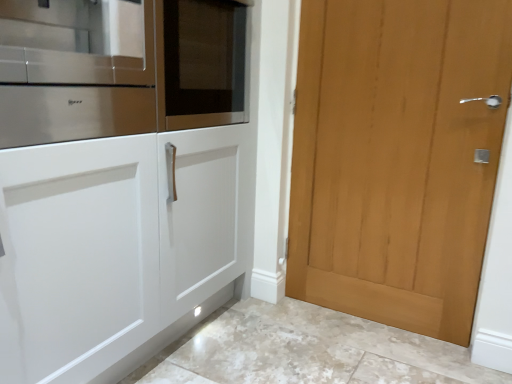
Describe the element at coordinates (396, 158) in the screenshot. I see `light brown wood door at right` at that location.

The image size is (512, 384). What are the coordinates of `light brown wood door at right` in the screenshot? It's located at (396, 158).

You are a GUI agent. You are given a task and a screenshot of the screen. Output one action in this format:
    pyautogui.click(x=<x>, y=<y>)
    Task: Click on the white marble floor at lower center
    This screenshot has width=512, height=384.
    Given the screenshot: What is the action you would take?
    pyautogui.click(x=313, y=351)

This screenshot has width=512, height=384. Identify the location of stainless steel oven at left. (75, 70).

Is point (147, 10) positioned before point (285, 357)?

Yes, it is in front of point (285, 357).

From the picture: Considering the relative sizes of stainless steel oven at left and white marble floor at lower center in the image provided, is stainless steel oven at left bigger than white marble floor at lower center?

Incorrect, stainless steel oven at left is not larger than white marble floor at lower center.

From the image's perspective, would you say stainless steel oven at left is shown under white marble floor at lower center?

No, from the image's perspective, stainless steel oven at left is not beneath white marble floor at lower center.

Is stainless steel oven at left positioned with its back to white marble floor at lower center?

No, stainless steel oven at left is not facing the opposite direction of white marble floor at lower center.

Would you say white marble floor at lower center is to the left or to the right of light brown wood door at right in the picture?

white marble floor at lower center is to the left of light brown wood door at right.

From a real-world perspective, between white marble floor at lower center and light brown wood door at right, who is vertically lower?

white marble floor at lower center is physically lower.

Locate an element on the screen. granite lying below the light brown wood door at right (from the image's perspective) is located at coordinates (313, 351).

Which object is closer to the camera taking this photo, white marble floor at lower center or light brown wood door at right?

white marble floor at lower center is closer to the camera.

Based on their positions, is stainless steel oven at left located to the left or right of light brown wood door at right?

In the image, stainless steel oven at left appears on the left side of light brown wood door at right.

Is light brown wood door at right located within stainless steel oven at left?

No, light brown wood door at right is not inside stainless steel oven at left.

Is stainless steel oven at left in contact with light brown wood door at right?

No, stainless steel oven at left is not making contact with light brown wood door at right.

Which of these two, stainless steel oven at left or light brown wood door at right, stands shorter?

stainless steel oven at left is shorter.

Looking at their sizes, would you say light brown wood door at right is wider or thinner than stainless steel oven at left?

In the image, light brown wood door at right appears to be more narrow than stainless steel oven at left.

Are light brown wood door at right and stainless steel oven at left beside each other?

No, light brown wood door at right is not touching stainless steel oven at left.

From the image's perspective, which is above, light brown wood door at right or stainless steel oven at left?

stainless steel oven at left.

Is white marble floor at lower center at the back of light brown wood door at right?

That's not correct — light brown wood door at right is not looking away from white marble floor at lower center.

From the image's perspective, is light brown wood door at right located beneath white marble floor at lower center?

No.

Considering the relative positions of light brown wood door at right and white marble floor at lower center in the image provided, is light brown wood door at right to the left or to the right of white marble floor at lower center?

light brown wood door at right is to the right of white marble floor at lower center.

From a real-world perspective, between white marble floor at lower center and stainless steel oven at left, who is vertically higher?

stainless steel oven at left is physically above.

Who is smaller, white marble floor at lower center or stainless steel oven at left?

stainless steel oven at left is smaller.

Looking at this image, between white marble floor at lower center and stainless steel oven at left, which one appears on the left side from the viewer's perspective?

From the viewer's perspective, stainless steel oven at left appears more on the left side.

From the image's perspective, who appears lower, white marble floor at lower center or stainless steel oven at left?

white marble floor at lower center is shown below in the image.

Find the location of a particular element. cabinetry above the white marble floor at lower center (from the image's perspective) is located at coordinates (75, 70).

Locate an element on the screen. The height and width of the screenshot is (384, 512). door that is behind the white marble floor at lower center is located at coordinates (396, 158).

Considering their positions, is white marble floor at lower center positioned closer to stainless steel oven at left than light brown wood door at right?

Based on the image, light brown wood door at right appears to be nearer to stainless steel oven at left.

Looking at the image, which one is located further to stainless steel oven at left, light brown wood door at right or white marble floor at lower center?

A: white marble floor at lower center is positioned further to the anchor stainless steel oven at left.

Looking at the image, which one is located closer to light brown wood door at right, stainless steel oven at left or white marble floor at lower center?

The object closer to light brown wood door at right is white marble floor at lower center.

In the scene shown: Looking at the image, which one is located further to white marble floor at lower center, stainless steel oven at left or light brown wood door at right?

stainless steel oven at left is further to white marble floor at lower center.

From the image, which object appears to be nearer to white marble floor at lower center, light brown wood door at right or stainless steel oven at left?

The object closer to white marble floor at lower center is light brown wood door at right.

Looking at this image, from the image, which object appears to be farther from light brown wood door at right, white marble floor at lower center or stainless steel oven at left?

stainless steel oven at left.

Identify the location of granite situated between stainless steel oven at left and light brown wood door at right from left to right. Image resolution: width=512 pixels, height=384 pixels. (313, 351).